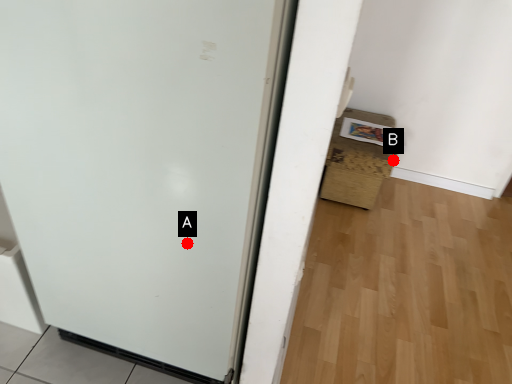
Question: Two points are circled on the image, labeled by A and B beside each circle. Which point is closer to the camera?

Choices:
 (A) A is closer
 (B) B is closer

Answer: (A)